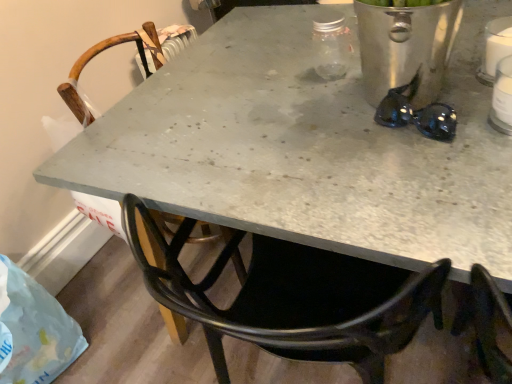
Identify the location of free space on the front side of black shiny sunglasses at upper right. (437, 172).